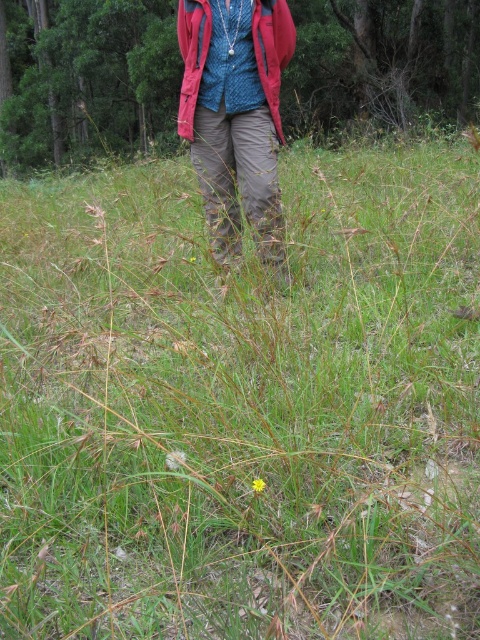
Question: Which point is closer to the camera taking this photo?

Choices:
 (A) (206, 154)
 (B) (228, 243)
 (C) (36, 102)

Answer: (A)

Question: Can you confirm if khaki pants at center is positioned above red fleece jacket at center?

Choices:
 (A) yes
 (B) no

Answer: (B)

Question: Among these objects, which one is nearest to the camera?

Choices:
 (A) green grass at center
 (B) knitted blue sweater at center
 (C) red fleece jacket at center

Answer: (B)

Question: Based on their relative distances, which object is nearer to the knitted blue sweater at center?

Choices:
 (A) khaki pants at center
 (B) green grass at center
 (C) red fleece jacket at center

Answer: (A)

Question: Does green grass at center appear on the right side of khaki pants at center?

Choices:
 (A) yes
 (B) no

Answer: (B)

Question: Is knitted blue sweater at center positioned behind khaki pants at center?

Choices:
 (A) no
 (B) yes

Answer: (A)